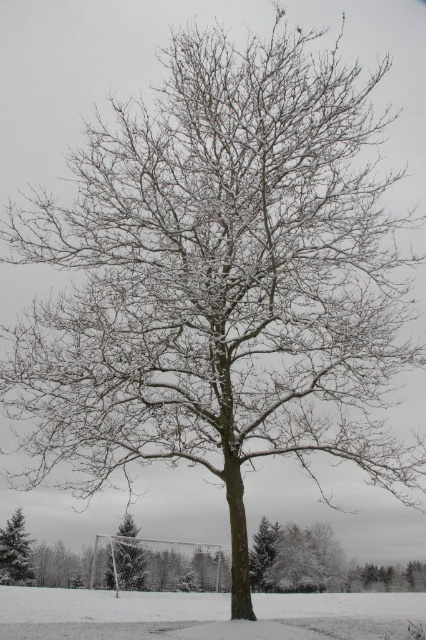
Question: Is white frosty tree at lower center wider than green matte evergreen tree at lower left?

Choices:
 (A) no
 (B) yes

Answer: (B)

Question: Estimate the real-world distances between objects in this image. Which object is closer to the white frosty tree at lower center?

Choices:
 (A) green matte evergreen tree at lower left
 (B) snowy grass at center

Answer: (A)

Question: Is snowy grass at center smaller than white frosty tree at lower center?

Choices:
 (A) no
 (B) yes

Answer: (B)

Question: Which object appears closest to the camera in this image?

Choices:
 (A) green matte evergreen tree at lower left
 (B) white frosty tree at lower center

Answer: (A)

Question: Which point appears farthest from the camera in this image?

Choices:
 (A) (201, 621)
 (B) (5, 529)

Answer: (B)

Question: Can you confirm if white frosty tree at lower center is bigger than green matte evergreen tree at lower left?

Choices:
 (A) no
 (B) yes

Answer: (B)